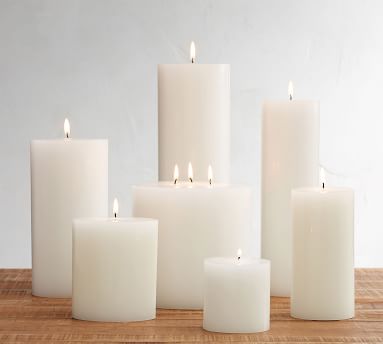
Locate an element on the screen. The width and height of the screenshot is (383, 344). candle is located at coordinates (48, 198), (116, 271), (247, 299), (315, 260), (172, 221), (203, 129), (291, 140).